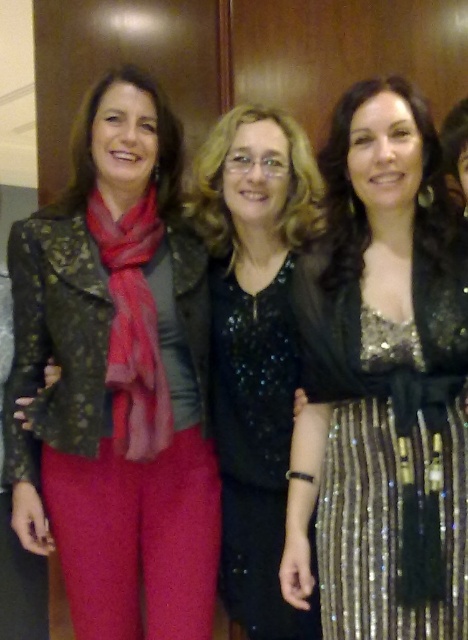
Which of these two, sequined gold dress at center or black sequined dress at center, stands taller?

black sequined dress at center is taller.

Between point (465, 552) and point (241, 388), which one is positioned behind?

The point (241, 388) is more distant.

Locate an element on the screen. sequined gold dress at center is located at coordinates (x=390, y=448).

In the scene shown: Who is higher up, matte black jacket at left or black sequined dress at center?

matte black jacket at left is above.

Between matte black jacket at left and black sequined dress at center, which one has less height?

black sequined dress at center is shorter.

Measure the distance between point [81,371] and camera.

Point [81,371] and camera are 1.45 meters apart from each other.

This screenshot has width=468, height=640. What are the coordinates of `matte black jacket at left` in the screenshot? It's located at (117, 378).

Between matte black jacket at left and sequined gold dress at center, which one appears on the left side from the viewer's perspective?

matte black jacket at left

Who is more forward, (37, 401) or (301, 337)?

Point (301, 337)

This screenshot has width=468, height=640. Find the location of `matte black jacket at left`. matte black jacket at left is located at coordinates (117, 378).